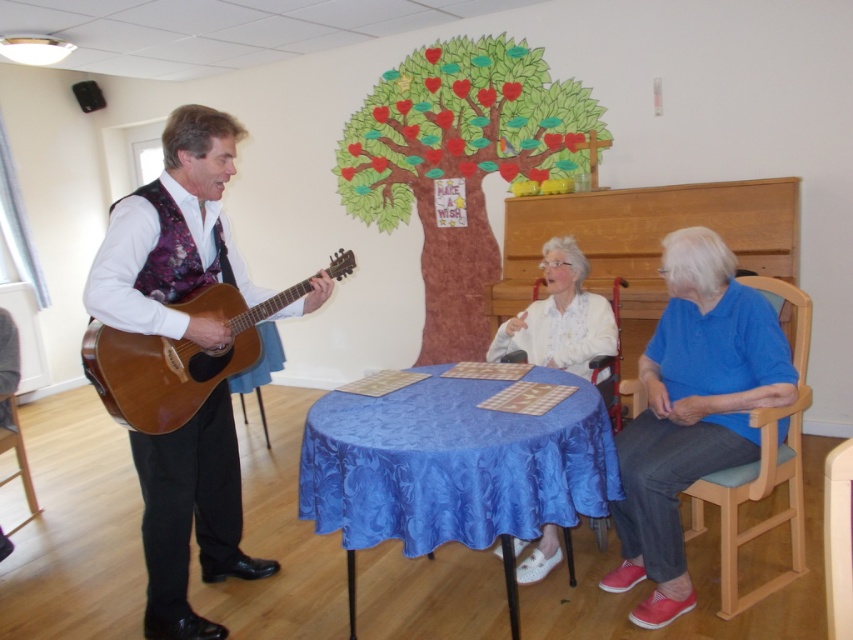
Question: Among these points, which one is nearest to the camera?

Choices:
 (A) (352, 189)
 (B) (550, 326)

Answer: (B)

Question: Is wooden chair at lower left above wooden chair at lower center?

Choices:
 (A) yes
 (B) no

Answer: (B)

Question: Is the position of green paper tree at upper center less distant than that of wooden chair at lower center?

Choices:
 (A) yes
 (B) no

Answer: (B)

Question: Can you confirm if blue fabric table at center is positioned to the right of white satin blouse at center?

Choices:
 (A) no
 (B) yes

Answer: (B)

Question: Which point is closer to the camera?

Choices:
 (A) wooden chair at lower center
 (B) wooden chair at lower left
 (C) wooden acoustic guitar at left
 (D) brown wooden guitar at left

Answer: (C)

Question: Which of the following is the closest to the observer?

Choices:
 (A) (x=579, y=324)
 (B) (x=1, y=392)
 (C) (x=350, y=195)
 (D) (x=119, y=392)

Answer: (D)